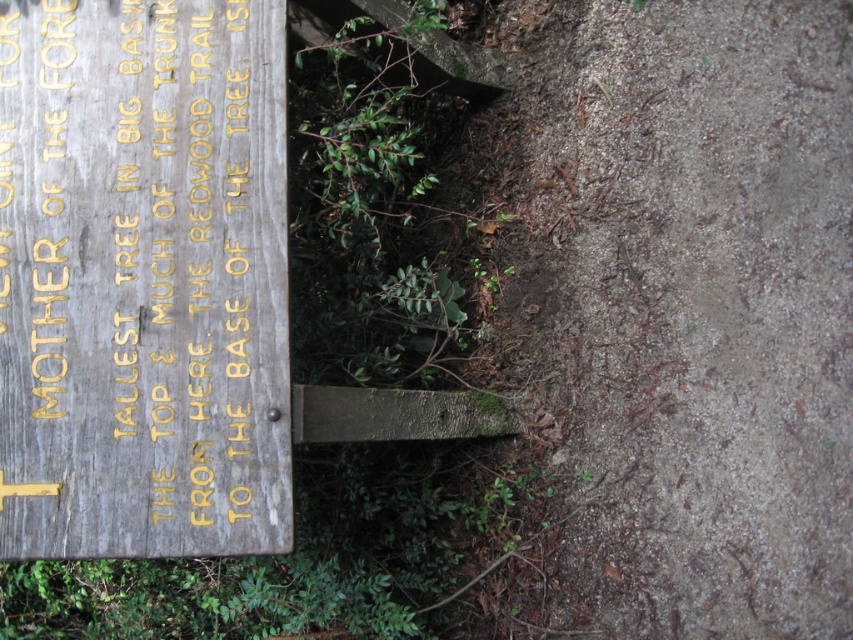
You are standing in front of the wooden signboard and want to reach both points marked on the ground. Which point, point (163, 529) or point (402, 157), is closer to you?

Point (163, 529) is closer to you than point (402, 157).